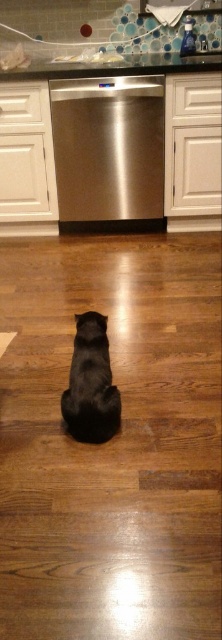
Question: Which object is positioned farthest from the shiny black cat at center?

Choices:
 (A) glassy countertop at upper center
 (B) stainless steel dishwasher at center

Answer: (A)

Question: Is shiny black cat at center bigger than glassy countertop at upper center?

Choices:
 (A) no
 (B) yes

Answer: (A)

Question: Among these points, which one is nearest to the camera?

Choices:
 (A) (65, 164)
 (B) (83, 380)
 (C) (109, 68)

Answer: (B)

Question: Does stainless steel dishwasher at center lie behind glassy countertop at upper center?

Choices:
 (A) no
 (B) yes

Answer: (B)

Question: Does stainless steel dishwasher at center have a lesser width compared to glassy countertop at upper center?

Choices:
 (A) no
 (B) yes

Answer: (B)

Question: Which point is closer to the camera?

Choices:
 (A) shiny black cat at center
 (B) stainless steel dishwasher at center
 (C) glassy countertop at upper center

Answer: (A)